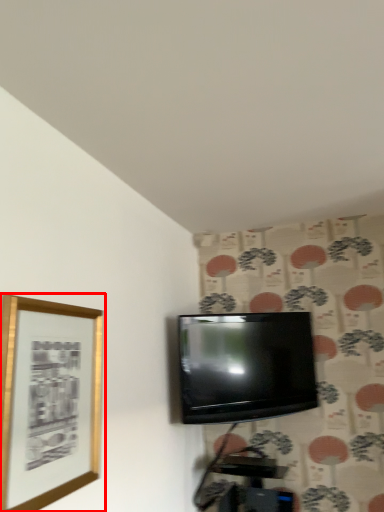
Question: Observing the image, what is the correct spatial positioning of picture frame (annotated by the red box) in reference to television?

Choices:
 (A) right
 (B) left

Answer: (B)